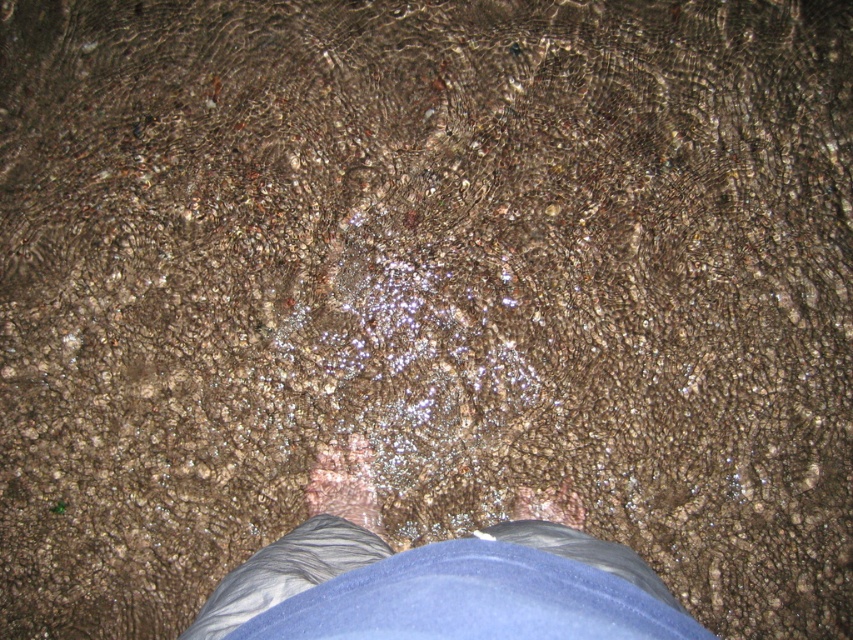
Is gray fabric pants at center shorter than matte skin foot at center?

Incorrect, gray fabric pants at center's height does not fall short of matte skin foot at center's.

You are a GUI agent. You are given a task and a screenshot of the screen. Output one action in this format:
    pyautogui.click(x=<x>, y=<y>)
    Task: Click on the gray fabric pants at center
    This screenshot has width=853, height=640.
    Given the screenshot: What is the action you would take?
    pyautogui.click(x=433, y=579)

Find the location of a particular element. gray fabric pants at center is located at coordinates (433, 579).

Who is shorter, matte skin foot at center or matte brown skin at center?

With less height is matte brown skin at center.

Find the location of `matte skin foot at center`. matte skin foot at center is located at coordinates (344, 483).

Where is `matte skin foot at center`? The width and height of the screenshot is (853, 640). matte skin foot at center is located at coordinates (344, 483).

Is gray fabric pants at center wider than matte brown skin at center?

Yes, gray fabric pants at center is wider than matte brown skin at center.

Does point (581, 588) come farther from viewer compared to point (518, 486)?

No.

Is point (368, 454) closer to camera compared to point (537, 513)?

No, (368, 454) is further to viewer.

Locate an element on the screen. This screenshot has width=853, height=640. gray fabric pants at center is located at coordinates (433, 579).